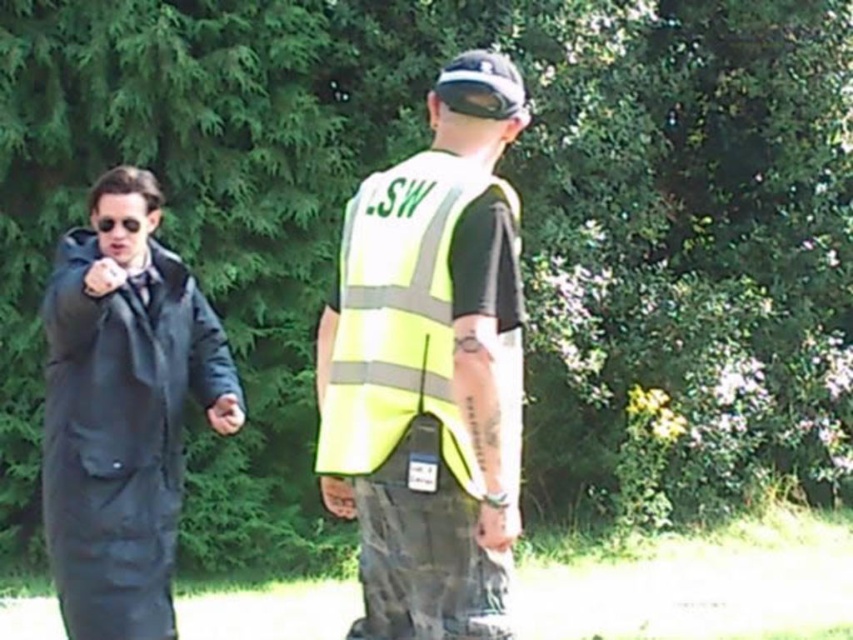
In the scene shown: Is matte black coat at left below yellow reflective vest at center?

Yes, matte black coat at left is below yellow reflective vest at center.

Who is more forward, (178, 262) or (344, 384)?

Positioned in front is point (344, 384).

What do you see at coordinates (123, 410) in the screenshot? I see `matte black coat at left` at bounding box center [123, 410].

Identify the location of matte black coat at left. (123, 410).